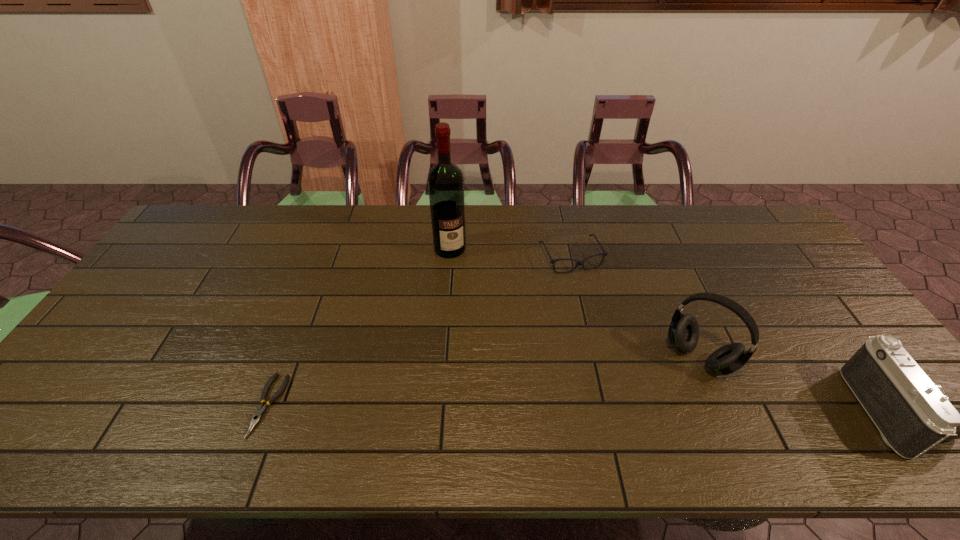
The width and height of the screenshot is (960, 540). I want to click on free space on the desktop that is between the leftmost object and the third shortest object and is positioned on the front-facing side of the spectacles, so click(651, 409).

I want to click on vacant space on the desktop that is between the pliers and the rightmost object and is positioned on the ear cups of the fourth shortest object, so click(656, 409).

Image resolution: width=960 pixels, height=540 pixels. Identify the location of free space on the desktop that is between the leftmost object and the rightmost object and is positioned on the front and back of the tallest object. (518, 408).